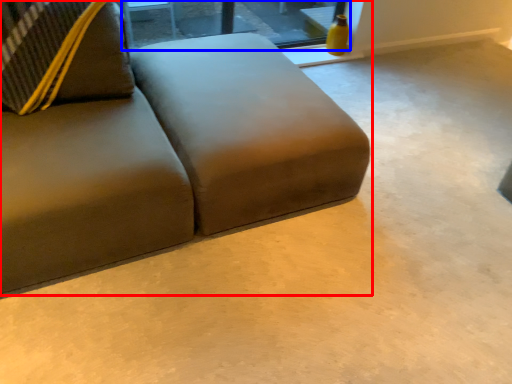
Question: Which object appears farthest to the camera in this image, studio couch (highlighted by a red box) or window (highlighted by a blue box)?

Choices:
 (A) studio couch
 (B) window

Answer: (B)